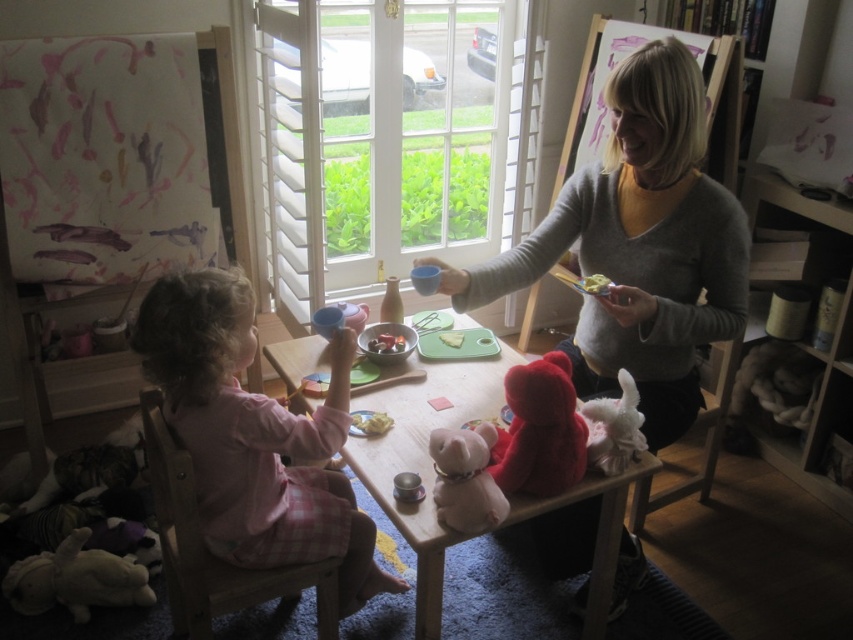
You are standing in the room and want to place a small decoration on the point marked at coordinates point (74,579). What object is located at that point?

The point (74,579) is on the fluffy white stuffed animal at lower left.

You are a guest at this tea party and want to place a small teacup between the fluffy white stuffed animal at lower left and the yellow creamy food at center. Can you fit it there?

The fluffy white stuffed animal at lower left is to the left of the yellow creamy food at center, so there is space between them to place the teacup.

Consider the image. You are a guest in this cozy room and want to pick up the smooth plastic toy at center without disturbing the pink cotton dress at left. Is the toy above or below the dress?

The pink cotton dress at left is positioned under the smooth plastic toy at center, so the toy is above the dress.